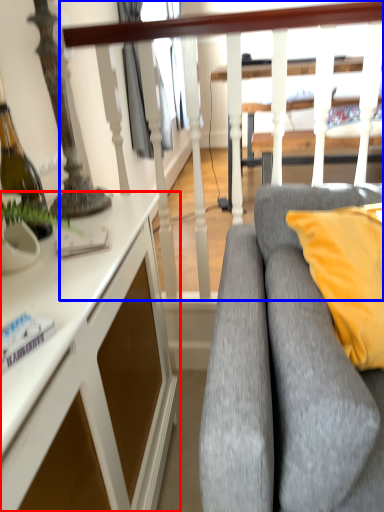
Question: Which object appears closest to the camera in this image, desk (highlighted by a red box) or rail (highlighted by a blue box)?

Choices:
 (A) desk
 (B) rail

Answer: (A)